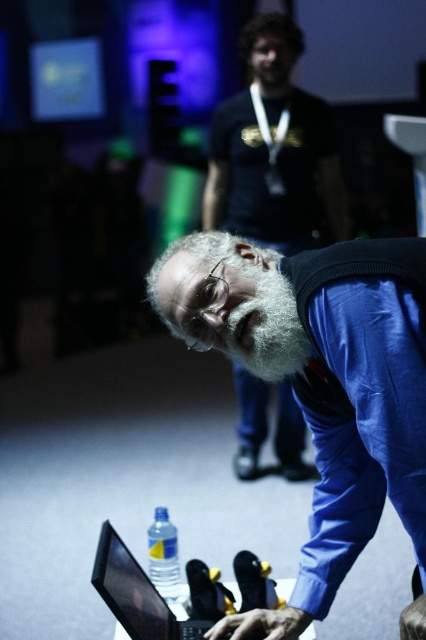
You are standing in the room and see the point at coordinates (264, 323). What object is located at that point?

The point at coordinates (264, 323) corresponds to graywoollybeard at center.

You are organizing a small conference and need to place a name tag on the table. The name tag must be placed to the left of the graywoollybeard at center. Where should you place the name tag in relation to the clear plastic bottle at lower center?

The graywoollybeard at center is to the right of the clear plastic bottle at lower center. Therefore, placing the name tag to the left of the graywoollybeard at center would mean positioning it to the left of the clear plastic bottle at lower center as well.